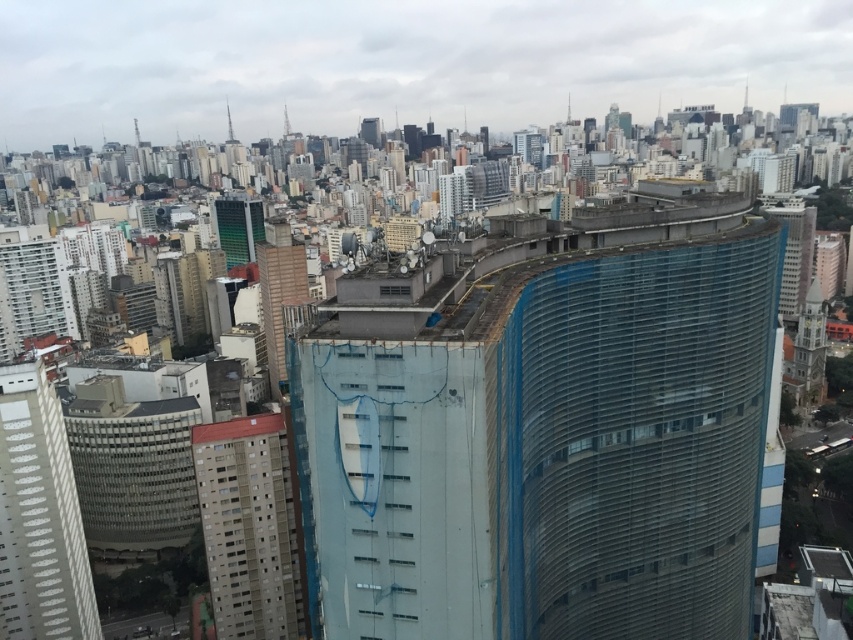
You are a city planner reviewing this urban layout. You need to determine if the white textured building at lower left is located in front of or behind the green glass tower at center. Based on the scene, which is it?

The white textured building at lower left is positioned under the green glass tower at center, meaning it is located behind the green glass tower at center.